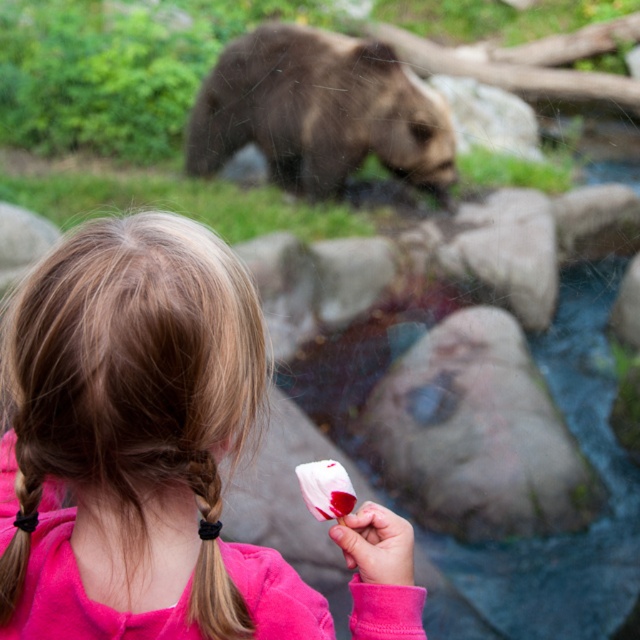
Question: Does brown fuzzy bear at upper center appear under black rubber band at back?

Choices:
 (A) no
 (B) yes

Answer: (A)

Question: Which point is closer to the camera taking this photo?

Choices:
 (A) (157, 572)
 (B) (276, 64)
 (C) (200, 595)

Answer: (C)

Question: Does pink fabric ice cream at center appear over brown fuzzy bear at upper center?

Choices:
 (A) no
 (B) yes

Answer: (A)

Question: Which point is farther from the camera taking this photo?

Choices:
 (A) (35, 401)
 (B) (378, 52)

Answer: (B)

Question: Which point is closer to the camera taking this photo?

Choices:
 (A) (250, 97)
 (B) (76, 241)

Answer: (B)

Question: Where is brown fuzzy bear at upper center located in relation to black rubber band at back in the image?

Choices:
 (A) below
 (B) above

Answer: (B)